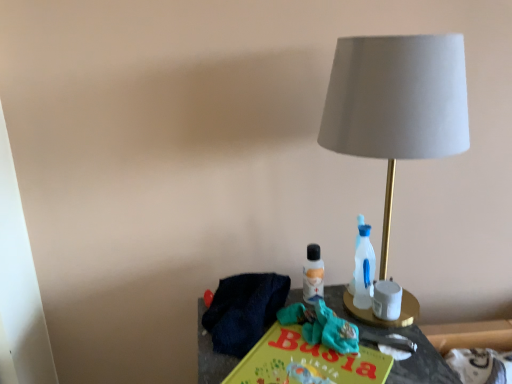
Question: Could you tell me if white matte candle holder at right is turned towards teal fabric scrub at center?

Choices:
 (A) yes
 (B) no

Answer: (B)

Question: From a real-world perspective, is white matte candle holder at right physically above teal fabric scrub at center?

Choices:
 (A) yes
 (B) no

Answer: (A)

Question: Considering the relative sizes of white matte candle holder at right and teal fabric scrub at center in the image provided, is white matte candle holder at right shorter than teal fabric scrub at center?

Choices:
 (A) no
 (B) yes

Answer: (A)

Question: Can you confirm if white matte candle holder at right is positioned to the right of teal fabric scrub at center?

Choices:
 (A) no
 (B) yes

Answer: (B)

Question: Considering the relative sizes of white matte candle holder at right and teal fabric scrub at center in the image provided, is white matte candle holder at right taller than teal fabric scrub at center?

Choices:
 (A) yes
 (B) no

Answer: (A)

Question: Is matte gray fabric lampshade at right wider or thinner than white matte candle holder at right?

Choices:
 (A) thin
 (B) wide

Answer: (B)

Question: Considering the positions of matte gray fabric lampshade at right and white matte candle holder at right in the image, is matte gray fabric lampshade at right bigger or smaller than white matte candle holder at right?

Choices:
 (A) small
 (B) big

Answer: (B)

Question: Is matte gray fabric lampshade at right spatially inside white matte candle holder at right, or outside of it?

Choices:
 (A) inside
 (B) outside

Answer: (B)

Question: Is matte gray fabric lampshade at right taller or shorter than white matte candle holder at right?

Choices:
 (A) tall
 (B) short

Answer: (A)

Question: In the image, is yellow matte paper at center positioned in front of or behind matte gray fabric lampshade at right?

Choices:
 (A) behind
 (B) front

Answer: (B)

Question: Is yellow matte paper at center inside or outside of matte gray fabric lampshade at right?

Choices:
 (A) inside
 (B) outside

Answer: (B)

Question: Visually, is yellow matte paper at center positioned to the left or to the right of matte gray fabric lampshade at right?

Choices:
 (A) left
 (B) right

Answer: (A)

Question: Considering the positions of yellow matte paper at center and matte gray fabric lampshade at right in the image, is yellow matte paper at center taller or shorter than matte gray fabric lampshade at right?

Choices:
 (A) tall
 (B) short

Answer: (B)

Question: In terms of height, does matte black book at center look taller or shorter compared to yellow matte paper at center?

Choices:
 (A) short
 (B) tall

Answer: (B)

Question: Considering their positions, is matte black book at center located in front of or behind yellow matte paper at center?

Choices:
 (A) behind
 (B) front

Answer: (A)